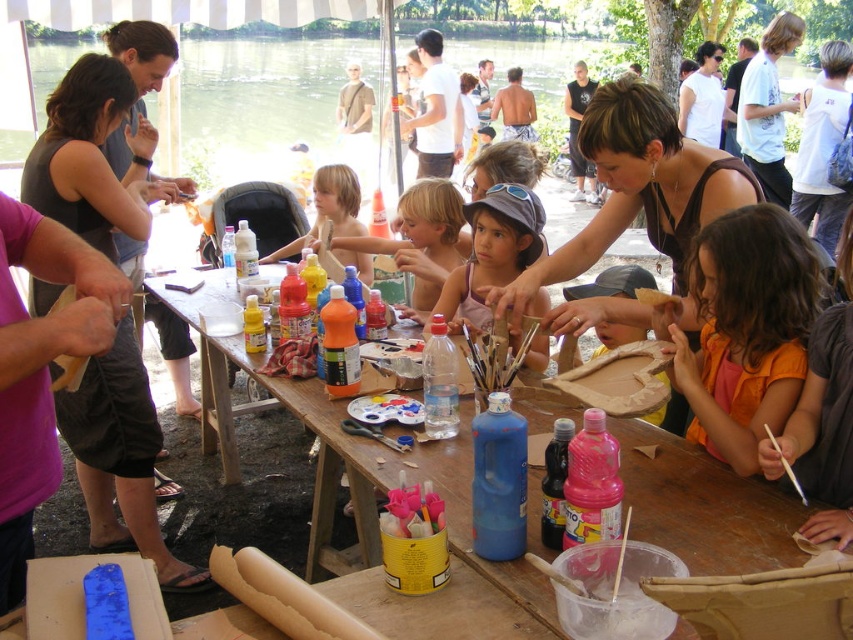
Which is more to the left, matte brown tank top at center or blonde hair at center?

From the viewer's perspective, blonde hair at center appears more on the left side.

Is point (614, 180) behind point (422, 198)?

That is False.

You are a GUI agent. You are given a task and a screenshot of the screen. Output one action in this format:
    pyautogui.click(x=<x>, y=<y>)
    Task: Click on the matte brown tank top at center
    
    Given the screenshot: What is the action you would take?
    click(640, 193)

The width and height of the screenshot is (853, 640). Describe the element at coordinates (358, 476) in the screenshot. I see `wooden table at center` at that location.

Is wooden table at center to the left of yellow paper at center from the viewer's perspective?

Correct, you'll find wooden table at center to the left of yellow paper at center.

Is point (390, 465) more distant than point (642, 289)?

No, it is not.

In order to click on wooden table at center in this screenshot , I will do `click(358, 476)`.

Who is positioned more to the right, pink fabric shirt at center or yellow paper at center?

yellow paper at center is more to the right.

Does pink fabric shirt at center have a lesser height compared to yellow paper at center?

Incorrect, pink fabric shirt at center's height does not fall short of yellow paper at center's.

Who is more forward, (473, 230) or (641, 294)?

Point (641, 294) is more forward.

Image resolution: width=853 pixels, height=640 pixels. What are the coordinates of `pink fabric shirt at center` in the screenshot? It's located at (492, 252).